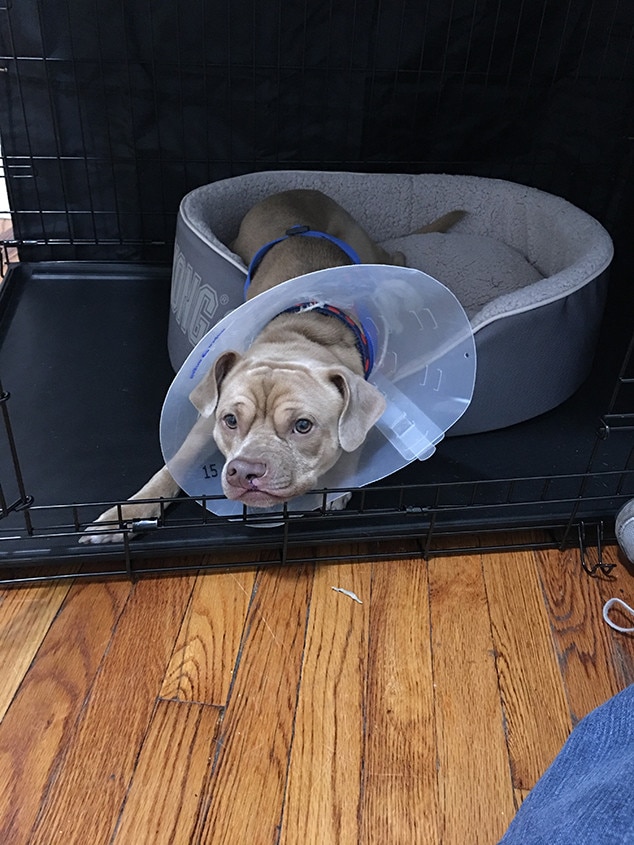
Locate an element on the screen. The width and height of the screenshot is (634, 845). bed is located at coordinates (499, 260).